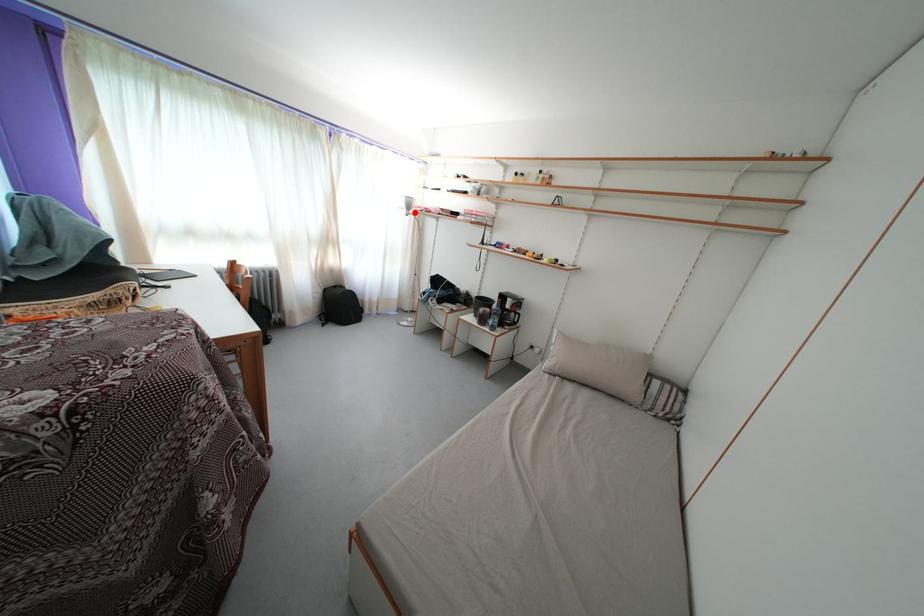
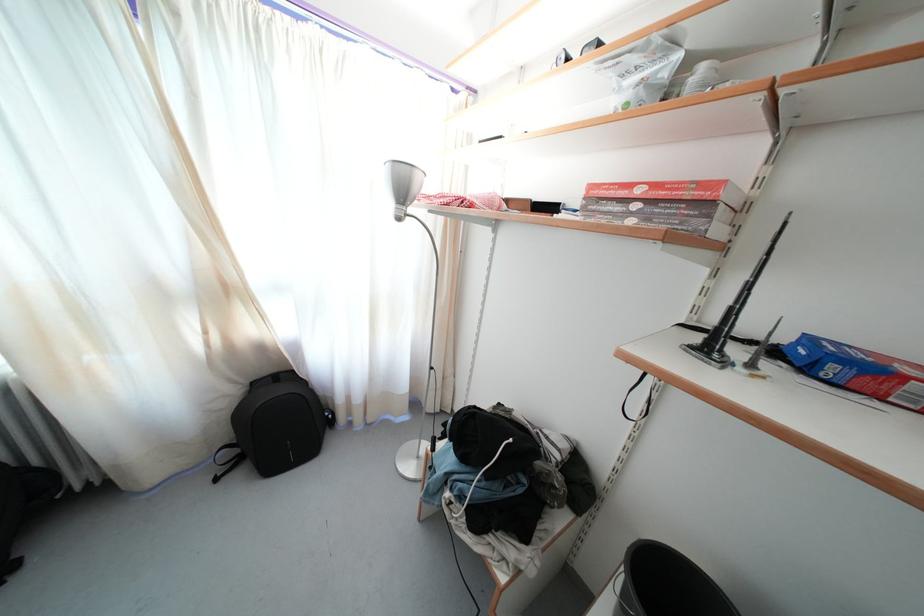
Question: I am providing you with two images of the same scene from different viewpoints. In image1, a red point is highlighted. Considering the same 3D point in image2, which of the following is correct?

Choices:
 (A) It is closer
 (B) It is farther

Answer: (B)